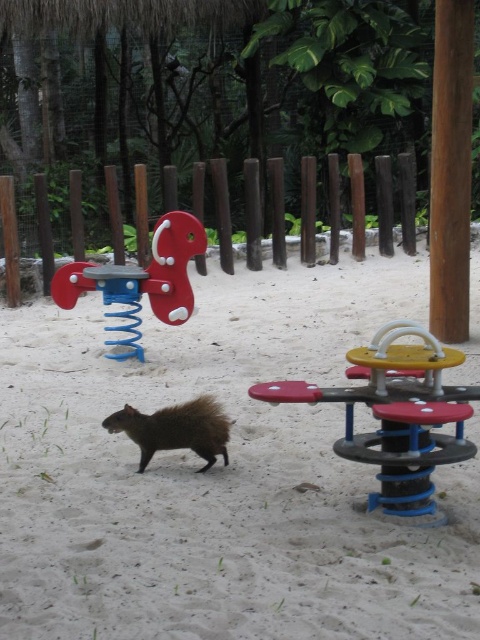
Which of these two, white sandy ground at center or matte plastic seesaw at left, stands shorter?

white sandy ground at center is shorter.

Can you confirm if white sandy ground at center is positioned below matte plastic seesaw at left?

Indeed, white sandy ground at center is positioned under matte plastic seesaw at left.

This screenshot has width=480, height=640. In order to click on white sandy ground at center in this screenshot , I will do tap(219, 476).

Can you confirm if yellow plastic seesaw at center is positioned below brown fuzzy squirrel at center?

No, yellow plastic seesaw at center is not below brown fuzzy squirrel at center.

The width and height of the screenshot is (480, 640). In order to click on yellow plastic seesaw at center in this screenshot , I will do `click(396, 413)`.

Describe the element at coordinates (396, 413) in the screenshot. I see `yellow plastic seesaw at center` at that location.

Where is `yellow plastic seesaw at center`? yellow plastic seesaw at center is located at coordinates (396, 413).

Is white sandy ground at center smaller than brown fuzzy squirrel at center?

Incorrect, white sandy ground at center is not smaller in size than brown fuzzy squirrel at center.

You are a GUI agent. You are given a task and a screenshot of the screen. Output one action in this format:
    pyautogui.click(x=<x>, y=<y>)
    Task: Click on the white sandy ground at center
    Image resolution: width=480 pixels, height=640 pixels.
    Given the screenshot: What is the action you would take?
    pyautogui.click(x=219, y=476)